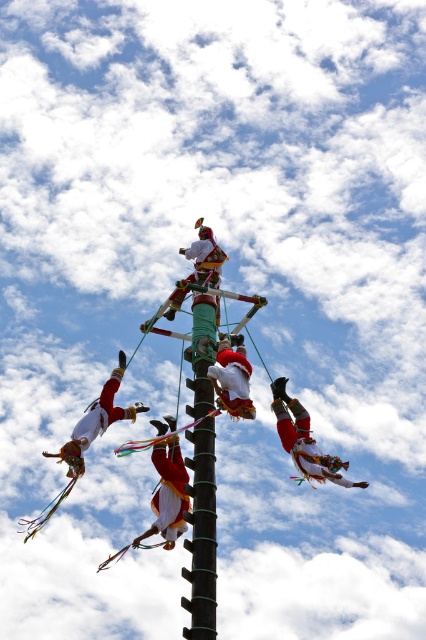
Question: Observing the image, what is the correct spatial positioning of red velvet ribbon at center in reference to white cotton pants at center?

Choices:
 (A) above
 (B) below

Answer: (B)

Question: Is green painted wood pole at center to the left of white cotton pants at center from the viewer's perspective?

Choices:
 (A) no
 (B) yes

Answer: (B)

Question: Which of the following is the farthest from the observer?

Choices:
 (A) white cotton pants at center
 (B) white cotton fabric at center
 (C) red velvet ribbon at center

Answer: (C)

Question: Does red velvet ribbon at center appear over white cotton pants at center?

Choices:
 (A) no
 (B) yes

Answer: (A)

Question: Estimate the real-world distances between objects in this image. Which object is closer to the white fabric dancer at lower left?

Choices:
 (A) red velvet ribbon at center
 (B) white cotton pants at center
 (C) white cotton fabric at center
 (D) green painted wood pole at center

Answer: (C)

Question: Which of the following is the farthest from the observer?

Choices:
 (A) red velvet ribbon at center
 (B) green painted wood pole at center
 (C) white cotton pants at center

Answer: (A)